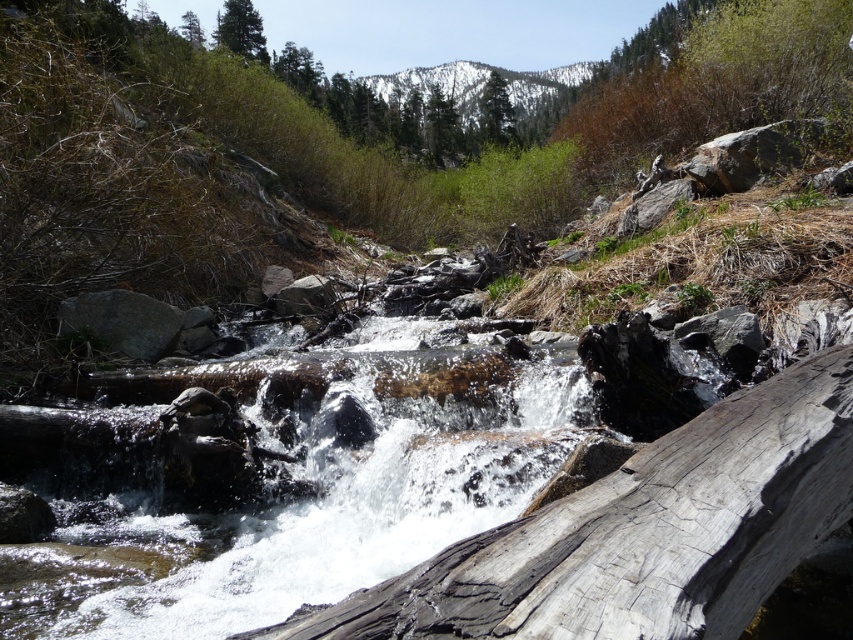
Is snowy rocky mountain at upper center taller than green textured tree at upper center?

Indeed, snowy rocky mountain at upper center has a greater height compared to green textured tree at upper center.

Image resolution: width=853 pixels, height=640 pixels. Describe the element at coordinates (485, 84) in the screenshot. I see `snowy rocky mountain at upper center` at that location.

Locate an element on the screen. snowy rocky mountain at upper center is located at coordinates (485, 84).

Measure the distance between gray rough wood at center and clear water at center.

gray rough wood at center is 12.71 feet from clear water at center.

Can you confirm if gray rough wood at center is positioned to the left of clear water at center?

No, gray rough wood at center is not to the left of clear water at center.

Who is more forward, (730, 460) or (340, 522)?

Point (730, 460)

This screenshot has height=640, width=853. I want to click on gray rough wood at center, so click(x=640, y=532).

Where is `green matte tree at upper left`? green matte tree at upper left is located at coordinates (241, 29).

Find the location of a particular element. This screenshot has height=640, width=853. green matte tree at upper left is located at coordinates (241, 29).